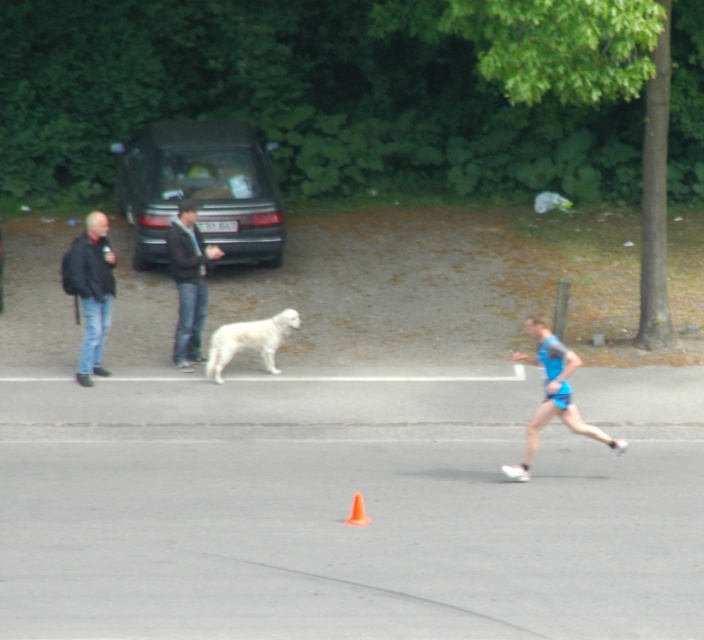
You are a photographer trying to capture the blue fabric runner at center and the dark gray jacket at center in a single shot. Which object should you focus on first to ensure both are in focus?

The blue fabric runner at center is closer to the viewer than the dark gray jacket at center, so focus on the blue fabric runner at center first to ensure both are in focus.

You are a photographer at the race event. You want to take a photo that includes both the white fluffy dog at center and the orange plastic traffic cone at center. Which object should you focus on first to ensure both are in the frame?

The white fluffy dog at center is above the orange plastic traffic cone at center, so you should focus on the orange plastic traffic cone at center first to ensure both are in the frame.